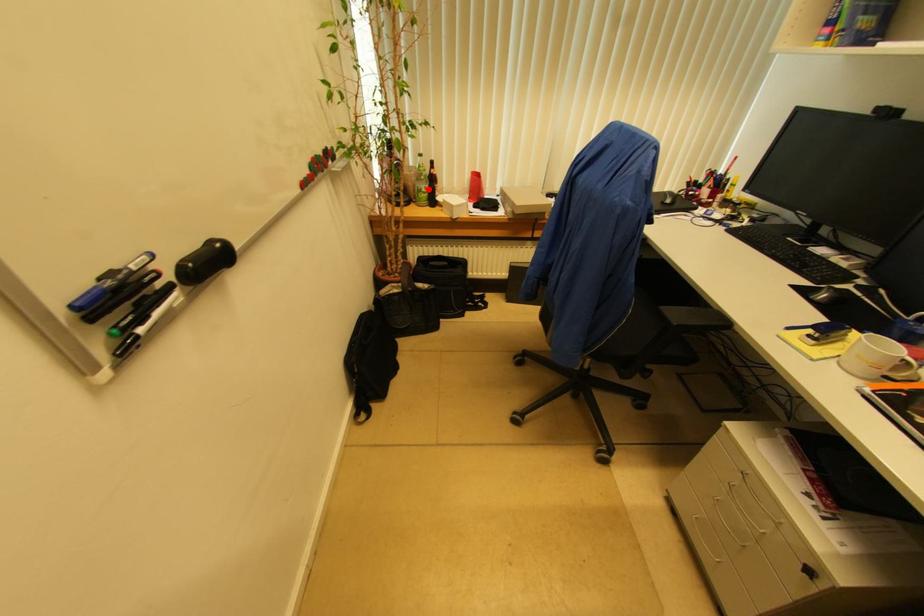
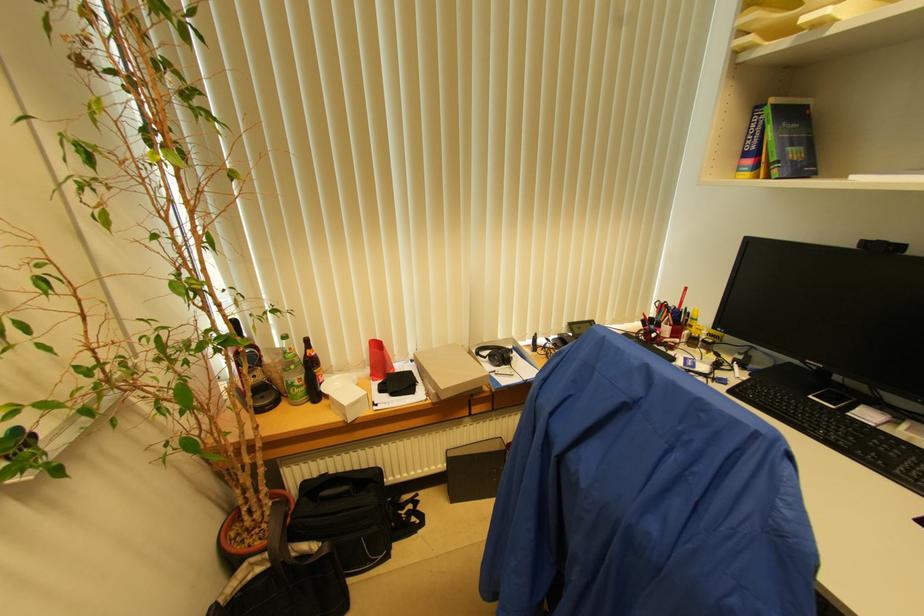
Question: I am providing you with two images of the same scene from different viewpoints. Image1 has a red point marked. In image2, the corresponding 3D location appears at what relative position? Reply with the corresponding letter.

Choices:
 (A) Closer
 (B) Farther

Answer: (B)